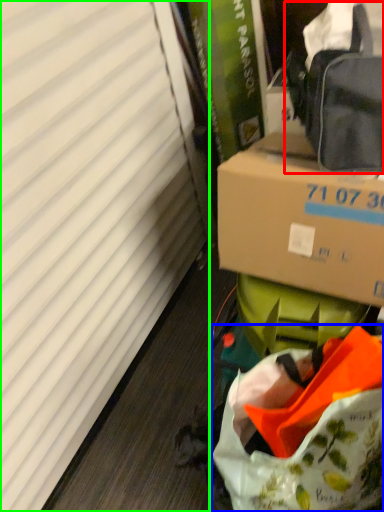
Question: Which object is the farthest from pack (highlighted by a red box)? Choose among these: bag (highlighted by a blue box) or curtain (highlighted by a green box).

Choices:
 (A) bag
 (B) curtain

Answer: (B)